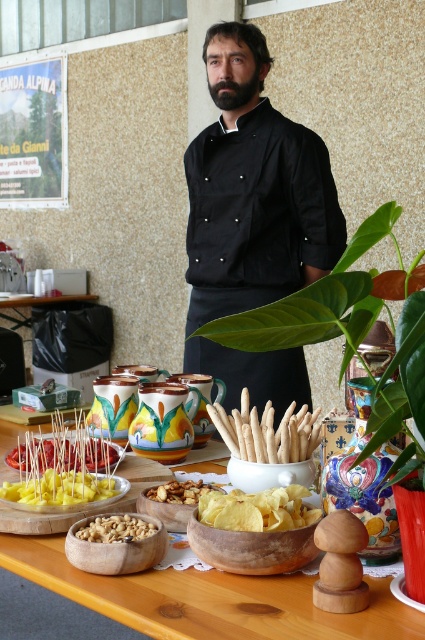
Question: Which of the following is the farthest from the observer?

Choices:
 (A) green leafy plant at center
 (B) yellow matte skewers at center
 (C) white matte asparagus at center
 (D) wooden bowls at center

Answer: (C)

Question: Is white matte asparagus at center below yellow cheese sticks at center?

Choices:
 (A) yes
 (B) no

Answer: (B)

Question: Which of the following is the closest to the observer?

Choices:
 (A) (82, 538)
 (B) (282, 144)
 (C) (249, 506)

Answer: (C)

Question: Considering the relative positions of wooden bowls at center and yellow matte skewers at center in the image provided, where is wooden bowls at center located with respect to yellow matte skewers at center?

Choices:
 (A) below
 (B) above

Answer: (A)

Question: Does black fabric chef at center have a smaller size compared to golden crispy chips at center?

Choices:
 (A) no
 (B) yes

Answer: (A)

Question: Which object is the closest to the black fabric chef at center?

Choices:
 (A) yellow matte skewers at center
 (B) crunchy nuts at center

Answer: (A)